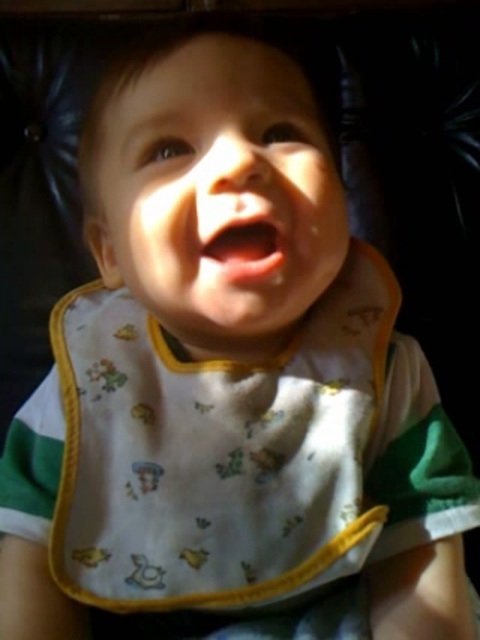
The width and height of the screenshot is (480, 640). Describe the element at coordinates (216, 192) in the screenshot. I see `smooth skin face at center` at that location.

From the picture: Is smooth skin face at center wider than pink glossy lips at center?

Yes, smooth skin face at center is wider than pink glossy lips at center.

Who is more forward, (211, 97) or (257, 253)?

Point (257, 253) is in front.

Locate an element on the screen. smooth skin face at center is located at coordinates (216, 192).

Is white/yellow fabric bib at center positioned before pink glossy lips at center?

No, it is behind pink glossy lips at center.

Which is behind, point (152, 456) or point (203, 232)?

The point (152, 456) is more distant.

Image resolution: width=480 pixels, height=640 pixels. In order to click on white/yellow fabric bib at center in this screenshot , I will do `click(216, 452)`.

Is point (224, 371) behind point (269, 147)?

Yes.

Consider the image. Which is above, white/yellow fabric bib at center or smooth skin face at center?

Positioned higher is smooth skin face at center.

This screenshot has width=480, height=640. What do you see at coordinates (216, 452) in the screenshot?
I see `white/yellow fabric bib at center` at bounding box center [216, 452].

You are a GUI agent. You are given a task and a screenshot of the screen. Output one action in this format:
    pyautogui.click(x=<x>, y=<y>)
    Task: Click on the white/yellow fabric bib at center
    
    Given the screenshot: What is the action you would take?
    click(216, 452)